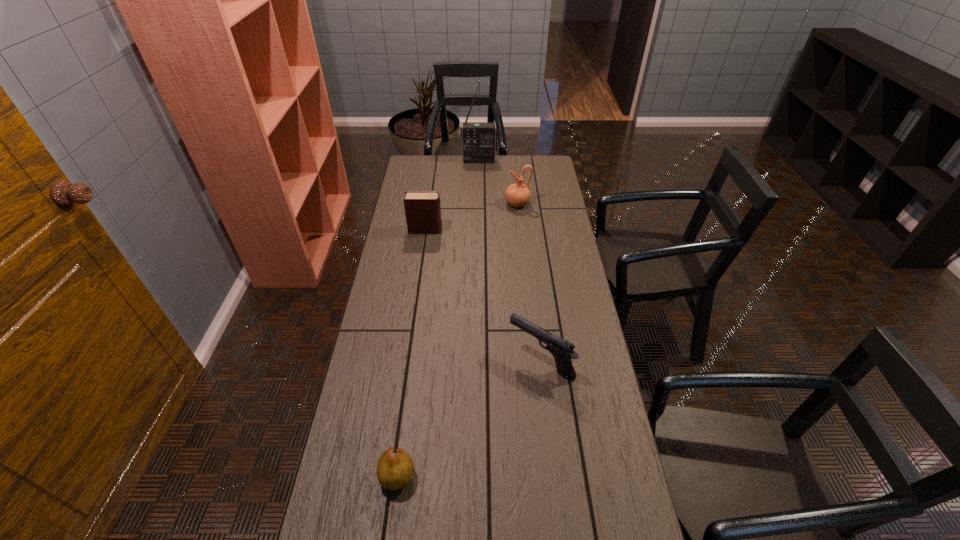
You are a GUI agent. You are given a task and a screenshot of the screen. Output one action in this format:
    pyautogui.click(x=<x>, y=<y>)
    Task: Click on the gun located in the right edge section of the desktop
    The width and height of the screenshot is (960, 540).
    Given the screenshot: What is the action you would take?
    pyautogui.click(x=562, y=350)

Identify the location of free space at the far edge. The image size is (960, 540). (494, 165).

The image size is (960, 540). In the image, there is a desktop. In order to click on vacant space at the left edge in this screenshot , I will do `click(409, 366)`.

This screenshot has width=960, height=540. In order to click on vacant space at the right edge in this screenshot , I will do `click(616, 458)`.

The image size is (960, 540). In order to click on vacant space that's between the fourth farthest object and the pottery in this screenshot , I will do `click(529, 282)`.

Identify the location of unoccupied area between the farthest object and the diary. (452, 195).

Find the location of a particular element. This screenshot has width=960, height=540. vacant area between the pottery and the nearest object is located at coordinates click(457, 340).

This screenshot has height=540, width=960. I want to click on free space between the radio receiver and the shortest object, so click(439, 318).

At what (x,y) coordinates should I click in order to perform the action: click on free space that is in between the pottery and the fourth farthest object. Please return your answer as a coordinate pair (x, y). The width and height of the screenshot is (960, 540). Looking at the image, I should click on (529, 282).

Where is `unoccupied area between the fourth nearest object and the tallest object`? unoccupied area between the fourth nearest object and the tallest object is located at coordinates (498, 182).